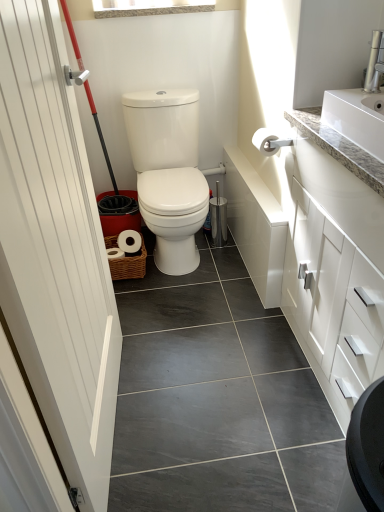
Question: Is white glossy cabinet at upper right thinner than white matte toilet paper at center?

Choices:
 (A) yes
 (B) no

Answer: (B)

Question: Can you confirm if white glossy cabinet at upper right is wider than white matte toilet paper at center?

Choices:
 (A) no
 (B) yes

Answer: (B)

Question: From the image's perspective, is white glossy cabinet at upper right below white matte toilet paper at center?

Choices:
 (A) yes
 (B) no

Answer: (A)

Question: Is white glossy cabinet at upper right positioned with its back to white matte toilet paper at center?

Choices:
 (A) yes
 (B) no

Answer: (B)

Question: Is there a large distance between white glossy cabinet at upper right and white matte toilet paper at center?

Choices:
 (A) yes
 (B) no

Answer: (B)

Question: Is white glossy cabinet at upper right to the left of white matte toilet paper at center from the viewer's perspective?

Choices:
 (A) yes
 (B) no

Answer: (B)

Question: Considering the relative sizes of white glossy toilet at center and silver metallic faucet at upper right in the image provided, is white glossy toilet at center bigger than silver metallic faucet at upper right?

Choices:
 (A) no
 (B) yes

Answer: (B)

Question: From the image's perspective, is white glossy toilet at center located beneath silver metallic faucet at upper right?

Choices:
 (A) yes
 (B) no

Answer: (A)

Question: From the image's perspective, would you say white glossy toilet at center is positioned over silver metallic faucet at upper right?

Choices:
 (A) no
 (B) yes

Answer: (A)

Question: Considering the relative positions of white glossy toilet at center and silver metallic faucet at upper right in the image provided, is white glossy toilet at center to the left of silver metallic faucet at upper right from the viewer's perspective?

Choices:
 (A) yes
 (B) no

Answer: (A)

Question: From a real-world perspective, is white glossy toilet at center positioned over silver metallic faucet at upper right based on gravity?

Choices:
 (A) no
 (B) yes

Answer: (A)

Question: Can you confirm if white glossy toilet at center is shorter than silver metallic faucet at upper right?

Choices:
 (A) yes
 (B) no

Answer: (B)

Question: Is silver metallic faucet at upper right turned away from white wood door at left?

Choices:
 (A) yes
 (B) no

Answer: (B)